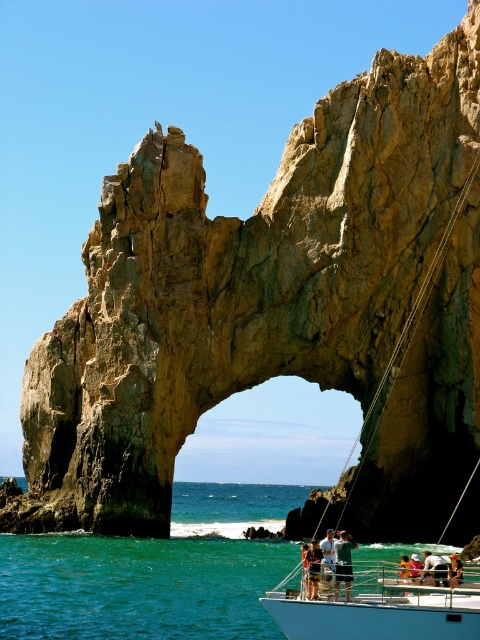
Who is lower down, white tennis racket at center or metallic silver helmet at center?

metallic silver helmet at center

Is white tennis racket at center to the left of metallic silver helmet at center from the viewer's perspective?

Correct, you'll find white tennis racket at center to the left of metallic silver helmet at center.

What do you see at coordinates (344, 563) in the screenshot? Image resolution: width=480 pixels, height=640 pixels. I see `white tennis racket at center` at bounding box center [344, 563].

Where is `white tennis racket at center`? The image size is (480, 640). white tennis racket at center is located at coordinates (344, 563).

Can you confirm if matte black shorts at lower center is positioned above metallic silver helmet at center?

No.

Who is more forward, (319, 560) or (441, 566)?

Point (441, 566)

You are a GUI agent. You are given a task and a screenshot of the screen. Output one action in this format:
    pyautogui.click(x=<x>, y=<y>)
    Task: Click on the matte black shorts at lower center
    
    Given the screenshot: What is the action you would take?
    pyautogui.click(x=312, y=568)

Who is higher up, white tennis racket at center or white fabric shirt at center?

Positioned higher is white tennis racket at center.

You are a GUI agent. You are given a task and a screenshot of the screen. Output one action in this format:
    pyautogui.click(x=<x>, y=<y>)
    Task: Click on the white tennis racket at center
    The image size is (480, 640).
    Given the screenshot: What is the action you would take?
    pyautogui.click(x=344, y=563)